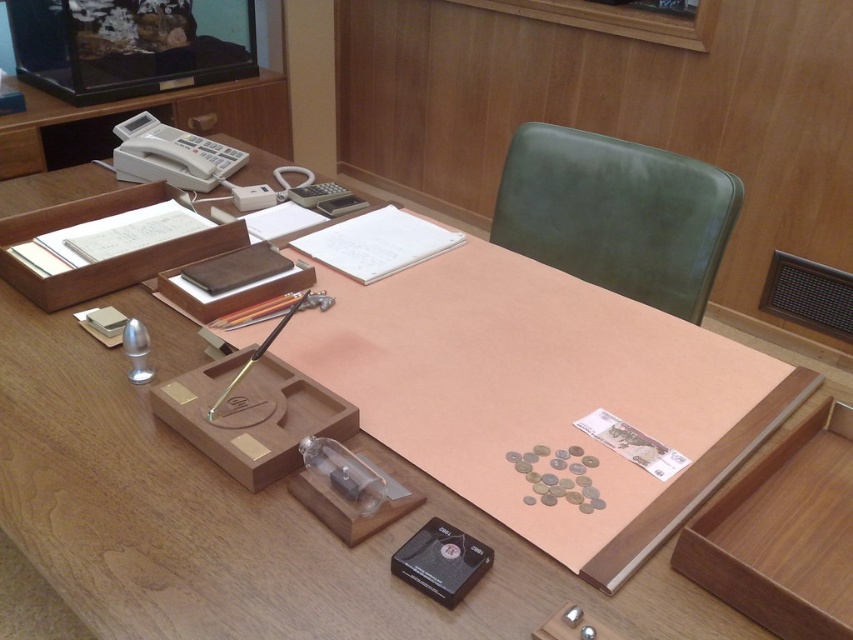
Does white plastic telephone at upper left have a lesser width compared to black plastic tape at lower center?

In fact, white plastic telephone at upper left might be wider than black plastic tape at lower center.

Based on the photo, who is taller, white plastic telephone at upper left or black plastic tape at lower center?

Standing taller between the two is white plastic telephone at upper left.

Which is in front, point (177, 180) or point (462, 566)?

Point (462, 566)

Locate an element on the screen. white plastic telephone at upper left is located at coordinates (x=171, y=156).

In the scene shown: Is wooden pen holder at center-left bigger than wooden drawer at lower left?

Indeed, wooden pen holder at center-left has a larger size compared to wooden drawer at lower left.

Is wooden pen holder at center-left above wooden drawer at lower left?

No.

Where is `wooden pen holder at center-left`? This screenshot has width=853, height=640. wooden pen holder at center-left is located at coordinates point(252,416).

Which is more to the right, green leather chair at upper right or wooden tray at lower right?

Positioned to the right is wooden tray at lower right.

At what (x,y) coordinates should I click in order to perform the action: click on green leather chair at upper right. Please return your answer as a coordinate pair (x, y). This screenshot has height=640, width=853. Looking at the image, I should click on (616, 214).